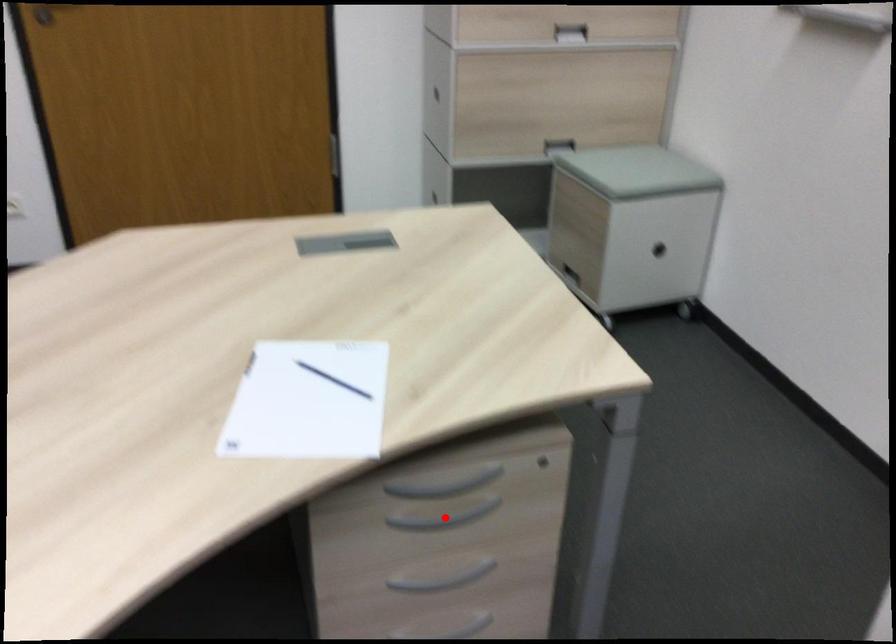
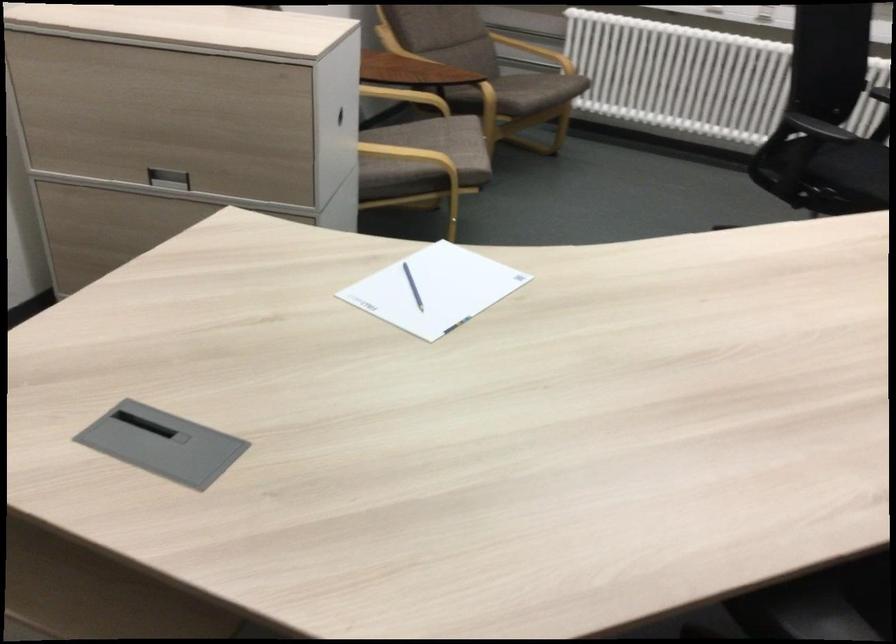
Question: I am providing you with two images of the same scene from different viewpoints. A red point is marked on the first image. Is the red point's position out of view in image 2?

Choices:
 (A) Yes
 (B) No

Answer: (A)